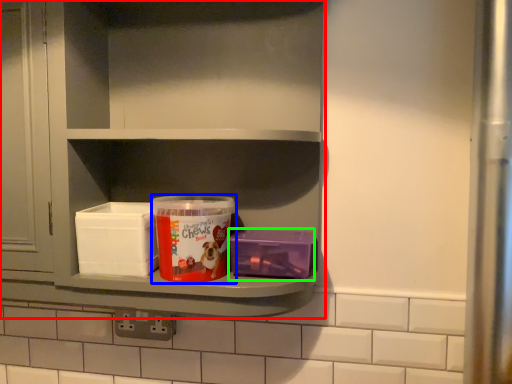
Question: Which is farther away from shelf (highlighted by a red box)? product (highlighted by a blue box) or box (highlighted by a green box)?

Choices:
 (A) product
 (B) box

Answer: (B)